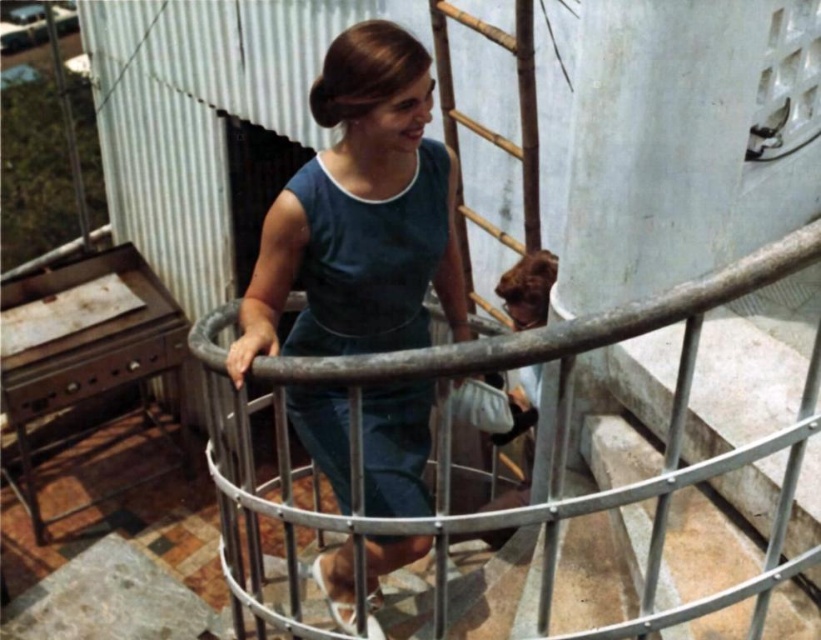
Question: Which object appears closest to the camera in this image?

Choices:
 (A) blue fabric dress at center
 (B) bamboo ladder at center
 (C) metallic silver railing at center

Answer: (C)

Question: Can you confirm if blue fabric dress at center is positioned below bamboo ladder at center?

Choices:
 (A) no
 (B) yes

Answer: (B)

Question: Is blue fabric dress at center further to the viewer compared to metallic silver railing at center?

Choices:
 (A) yes
 (B) no

Answer: (A)

Question: Which of the following is the farthest from the observer?

Choices:
 (A) bamboo ladder at center
 (B) metallic silver railing at center
 (C) blue fabric dress at center

Answer: (A)

Question: Which of the following is the closest to the observer?

Choices:
 (A) (517, 88)
 (B) (375, 548)
 (C) (223, 573)

Answer: (B)

Question: Is blue fabric dress at center above metallic silver railing at center?

Choices:
 (A) yes
 (B) no

Answer: (A)